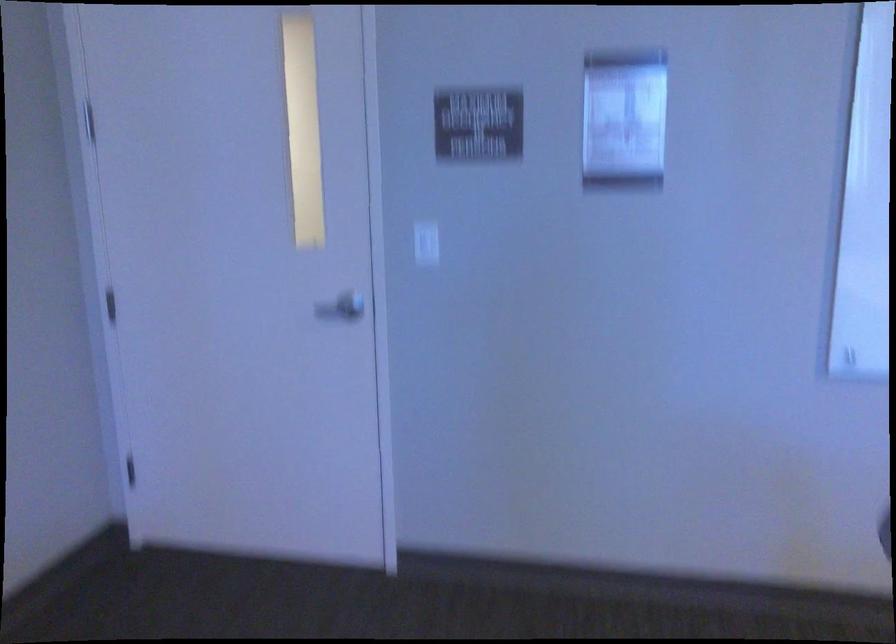
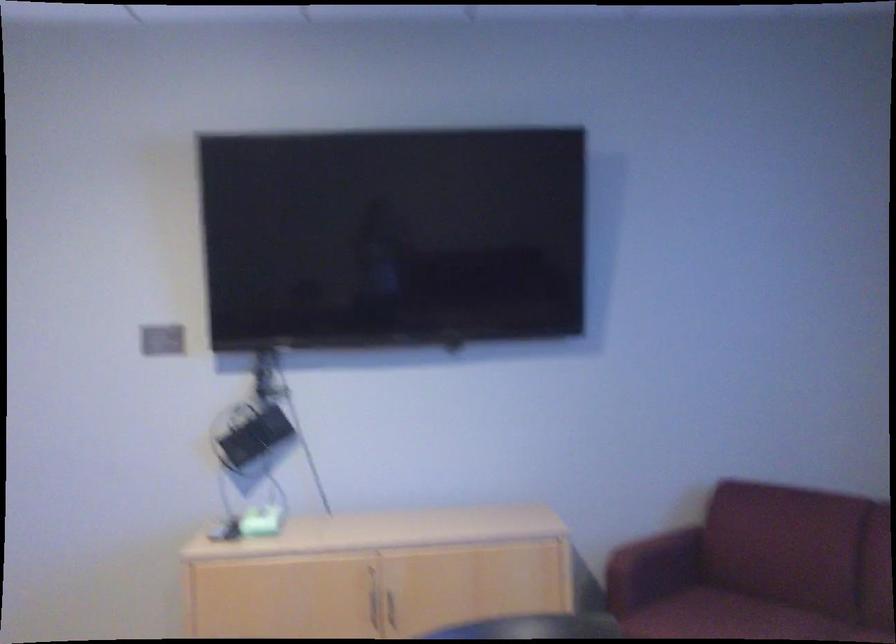
Question: The camera is either moving clockwise (left) or counter-clockwise (right) around the object. The first image is from the beginning of the video and the second image is from the end. Is the camera moving left or right when shooting the video?

Choices:
 (A) Left
 (B) Right

Answer: (A)